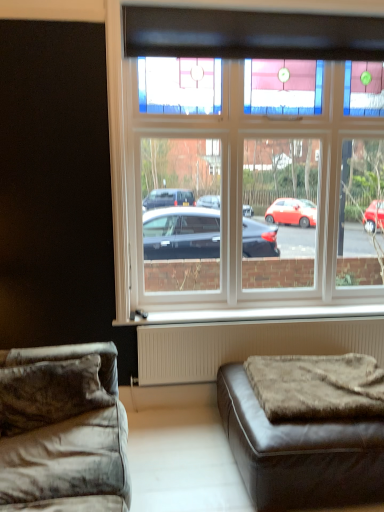
I want to click on vacant region above white textured radiator at lower center (from a real-world perspective), so click(x=273, y=317).